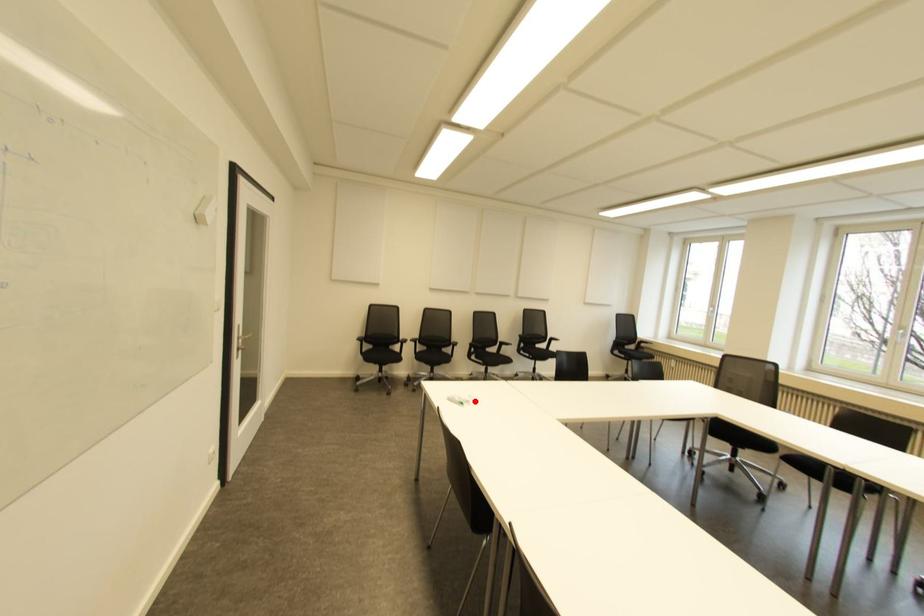
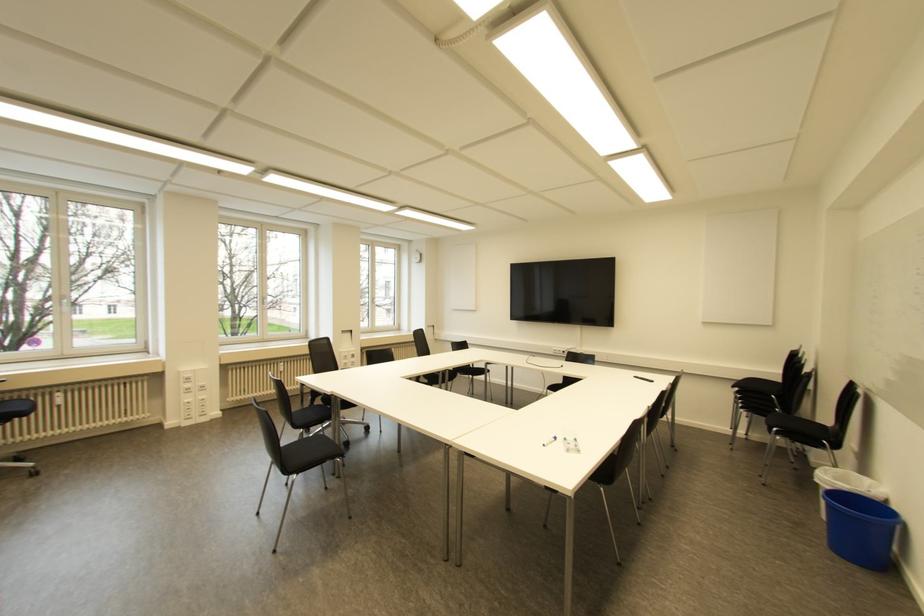
Where in the second image is the point corresponding to the highlighted location from the first image?

(554, 438)